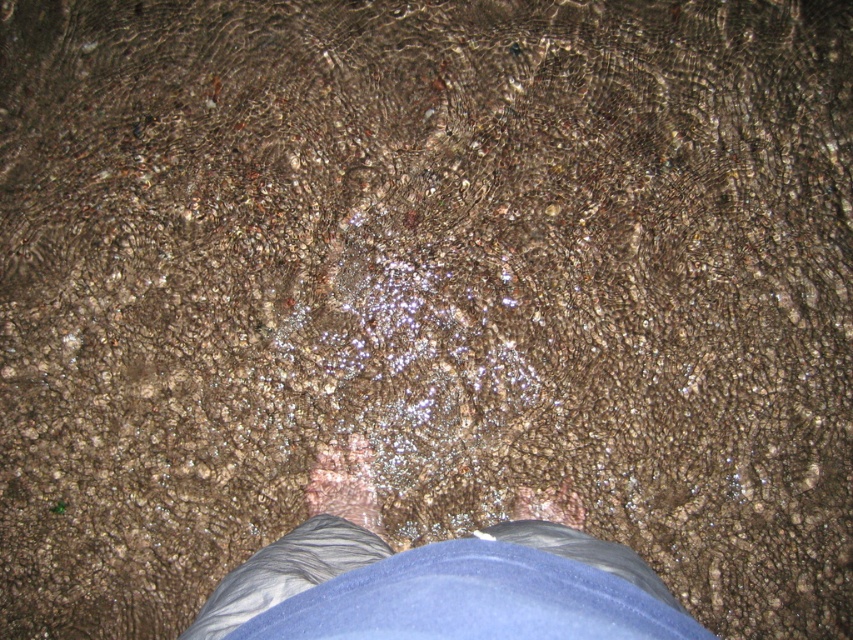
You are standing at the edge of a shallow stream and see a point marked at coordinates point (494, 540). You have a 24 inch long stick. Can you reach the point with the stick without moving your feet?

The distance of point (494, 540) from viewer is 26.75 inches. Since the stick is only 24 inches long, you cannot reach the point with the stick without moving your feet.

You are a lifeguard observing a scene where a person is standing in water. You see the gray fabric pants at center and the matte brown skin at center. Which object is taller?

The gray fabric pants at center is taller than the matte brown skin at center.